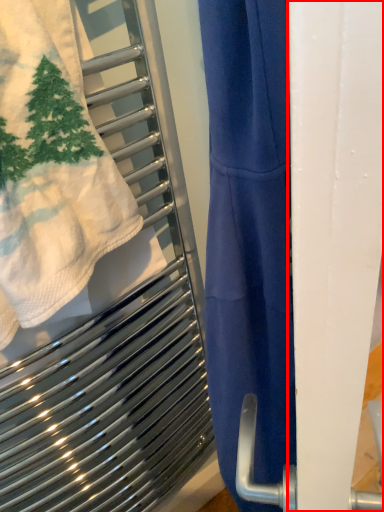
Question: From the image's perspective, where is screen door (annotated by the red box) located relative to towel?

Choices:
 (A) above
 (B) below

Answer: (B)